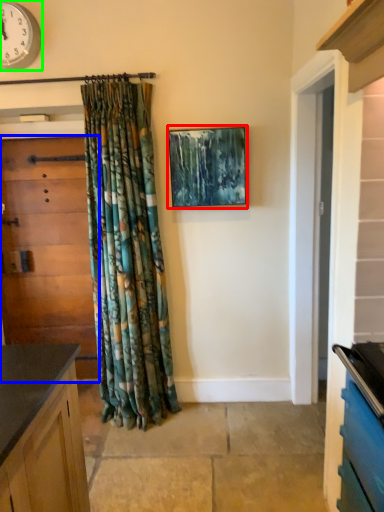
Question: Which is farther away from picture frame (highlighted by a red box)? door (highlighted by a blue box) or clock (highlighted by a green box)?

Choices:
 (A) door
 (B) clock

Answer: (B)